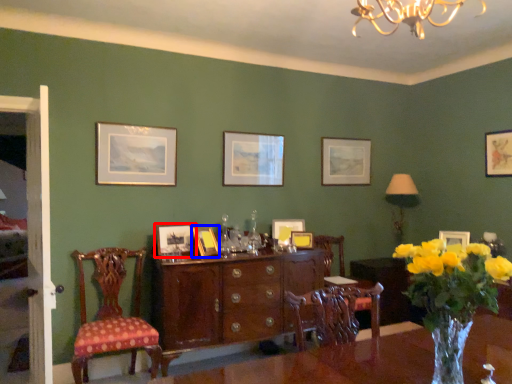
Question: Which of the following is the farthest to the observer, picture frame (highlighted by a red box) or picture frame (highlighted by a blue box)?

Choices:
 (A) picture frame
 (B) picture frame

Answer: (A)